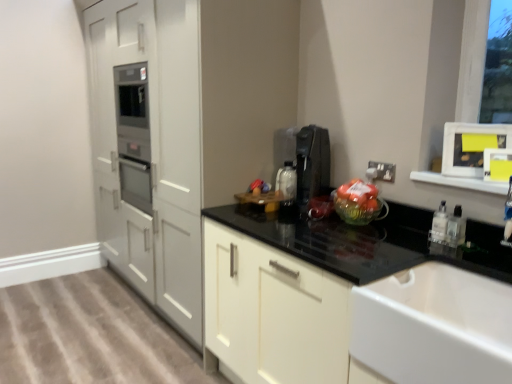
Question: Is white plastic electric outlet at upper right positioned behind clear plastic bottle at lower right, which is the second bottle from left to right?

Choices:
 (A) no
 (B) yes

Answer: (B)

Question: Does white plastic electric outlet at upper right have a lesser height compared to clear plastic bottle at lower right, which is the second bottle from left to right?

Choices:
 (A) yes
 (B) no

Answer: (A)

Question: Is white plastic electric outlet at upper right not close to clear plastic bottle at lower right, which is the second bottle from left to right?

Choices:
 (A) no
 (B) yes

Answer: (A)

Question: Can you confirm if white plastic electric outlet at upper right is smaller than clear plastic bottle at lower right, the first bottle viewed from the right?

Choices:
 (A) no
 (B) yes

Answer: (B)

Question: Does white plastic electric outlet at upper right turn towards clear plastic bottle at lower right, which is the second bottle from left to right?

Choices:
 (A) no
 (B) yes

Answer: (A)

Question: From a real-world perspective, is white plastic electric outlet at upper right physically below clear plastic bottle at lower right, which is the second bottle from left to right?

Choices:
 (A) yes
 (B) no

Answer: (B)

Question: From the image's perspective, does black plastic coffee machine at upper right appear lower than translucent plastic bag of oranges at center-right?

Choices:
 (A) no
 (B) yes

Answer: (A)

Question: Is black plastic coffee machine at upper right surrounding translucent plastic bag of oranges at center-right?

Choices:
 (A) yes
 (B) no

Answer: (B)

Question: Does black plastic coffee machine at upper right have a lesser width compared to translucent plastic bag of oranges at center-right?

Choices:
 (A) no
 (B) yes

Answer: (A)

Question: From the image's perspective, is black plastic coffee machine at upper right on top of translucent plastic bag of oranges at center-right?

Choices:
 (A) yes
 (B) no

Answer: (A)

Question: Considering the relative positions of black plastic coffee machine at upper right and translucent plastic bag of oranges at center-right in the image provided, is black plastic coffee machine at upper right in front of translucent plastic bag of oranges at center-right?

Choices:
 (A) yes
 (B) no

Answer: (B)

Question: Is black plastic coffee machine at upper right taller than translucent plastic bag of oranges at center-right?

Choices:
 (A) no
 (B) yes

Answer: (B)

Question: Does white plastic electric outlet at upper right have a smaller size compared to clear plastic bottle at right, the first bottle when ordered from left to right?

Choices:
 (A) yes
 (B) no

Answer: (A)